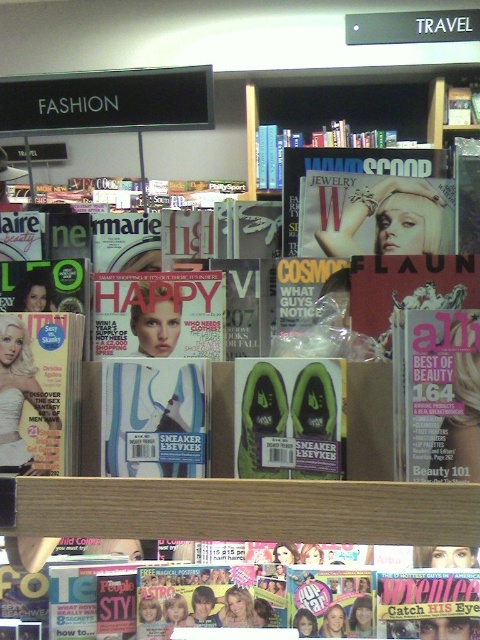
Question: Which object appears closest to the camera in this image?

Choices:
 (A) matte blue sneaker at center
 (B) matte paper magazine at center
 (C) matte glossy cover at center
 (D) black plastic signboard at upper center

Answer: (C)

Question: Which of the following is the closest to the observer?

Choices:
 (A) (460, 397)
 (B) (179, 129)
 (C) (305, 364)

Answer: (A)

Question: Does matte pink magazine at center appear under matte paper magazine at center?

Choices:
 (A) yes
 (B) no

Answer: (A)

Question: Which object appears closest to the camera in this image?

Choices:
 (A) matte blue sneaker at center
 (B) matte paper magazine at center
 (C) green matte sneakers at center
 (D) black plastic signboard at upper center

Answer: (C)

Question: Can you confirm if green matte sneakers at center is positioned below matte glossy cover at center?

Choices:
 (A) yes
 (B) no

Answer: (A)

Question: Does matte pink magazine at center appear on the left side of green matte sneakers at center?

Choices:
 (A) no
 (B) yes

Answer: (B)